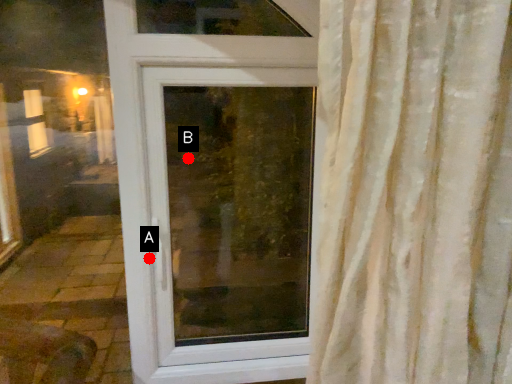
Question: Two points are circled on the image, labeled by A and B beside each circle. Which point appears closest to the camera in this image?

Choices:
 (A) A is closer
 (B) B is closer

Answer: (A)